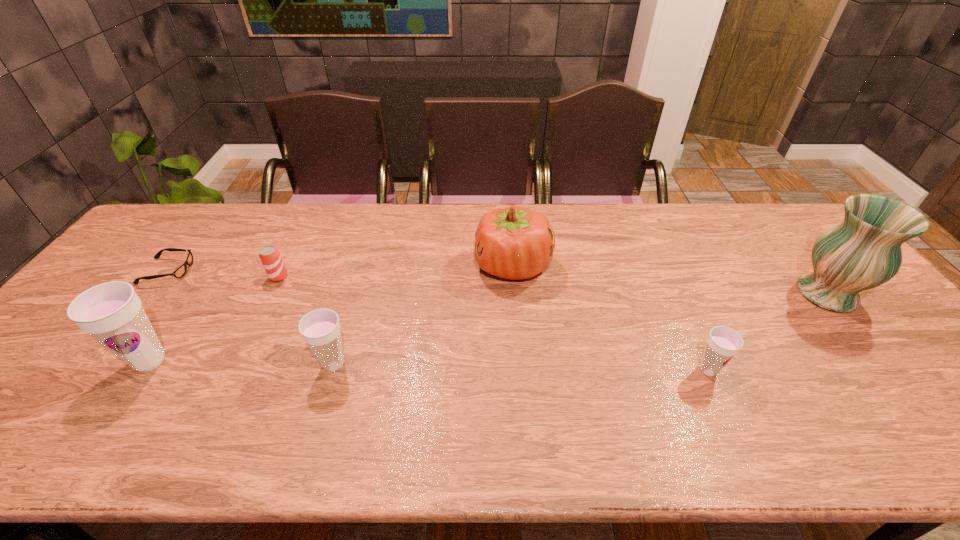
You are a GUI agent. You are given a task and a screenshot of the screen. Output one action in this format:
    pyautogui.click(x=<x>, y=<y>)
    Task: Click on the object that is at the far edge
    Image resolution: width=960 pixels, height=540 pixels.
    Given the screenshot: What is the action you would take?
    pyautogui.click(x=515, y=243)

Where is `object that is at the left edge`? The image size is (960, 540). object that is at the left edge is located at coordinates (179, 272).

You are a GUI agent. You are given a task and a screenshot of the screen. Output one action in this format:
    pyautogui.click(x=<x>, y=<y>)
    Task: Click on the object positioned at the right edge
    Image resolution: width=960 pixels, height=540 pixels.
    Given the screenshot: What is the action you would take?
    pyautogui.click(x=863, y=252)

The height and width of the screenshot is (540, 960). What are the coordinates of `vacant area at the far edge of the desktop` in the screenshot? It's located at (571, 220).

Find the location of a particular element. This screenshot has height=540, width=960. free space at the near edge of the desktop is located at coordinates (551, 410).

In the image, there is a desktop. Identify the location of free space at the left edge. (86, 352).

This screenshot has height=540, width=960. What are the coordinates of `vacant space at the far right corner of the desktop` in the screenshot? It's located at (763, 227).

In order to click on vacant region between the second tallest cup and the rightmost cup in this screenshot , I will do `click(521, 367)`.

Where is `vacant area that lies between the shortest object and the second shortest cup`? The image size is (960, 540). vacant area that lies between the shortest object and the second shortest cup is located at coordinates (251, 318).

You are a GUI agent. You are given a task and a screenshot of the screen. Output one action in this format:
    pyautogui.click(x=<x>, y=<y>)
    Task: Click on the unoccupied area between the pumpkin and the rightmost cup
    
    Given the screenshot: What is the action you would take?
    611,318